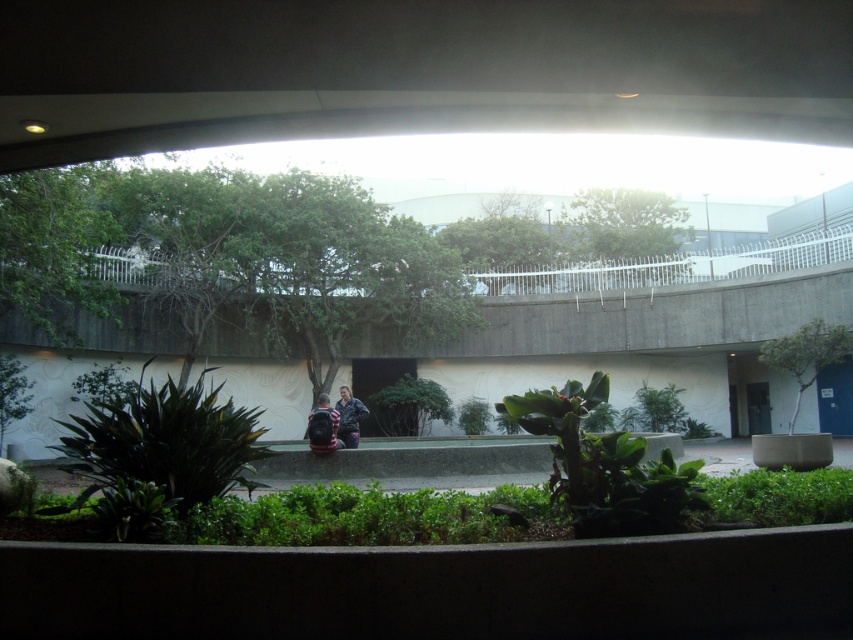
Question: Does dark green leafy plant at center appear under green leafy tree at upper center?

Choices:
 (A) no
 (B) yes

Answer: (B)

Question: Which point is farther to the camera?

Choices:
 (A) (312, 417)
 (B) (119, 516)

Answer: (A)

Question: Does green leafy tree at upper center lie behind dark blue backpack at center?

Choices:
 (A) no
 (B) yes

Answer: (B)

Question: Estimate the real-world distances between objects in this image. Which object is closer to the green leafy tree at right?

Choices:
 (A) dark blue jacket at center
 (B) dark green leafy plant at center
 (C) dark blue backpack at center
 (D) green leafy tree at upper center

Answer: (D)

Question: Can you confirm if green leafy tree at right is positioned to the left of dark blue jacket at center?

Choices:
 (A) no
 (B) yes

Answer: (A)

Question: Which point is farther to the camera?

Choices:
 (A) dark blue backpack at center
 (B) dark green leafy plant at center
 (C) green leafy tree at upper center
 (D) dark blue jacket at center

Answer: (C)